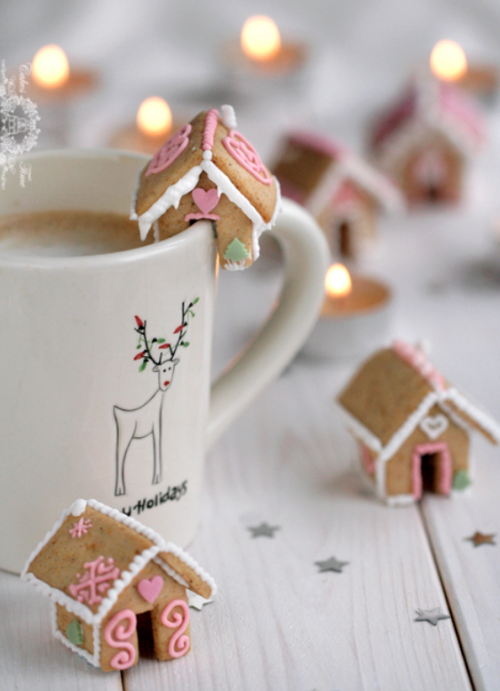
At what (x,y) coordinates should I click in order to perform the action: click on 3 green christmas tree decorations. Please return your answer as a coordinate pair (x, y). The width and height of the screenshot is (500, 691). Looking at the image, I should click on (235, 249), (75, 632), (462, 482).